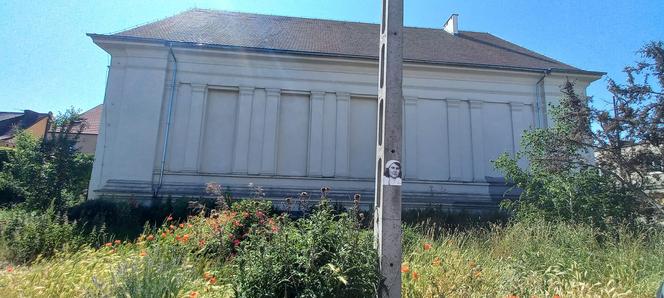
This screenshot has width=664, height=298. I want to click on grey pillar, so click(x=392, y=95).